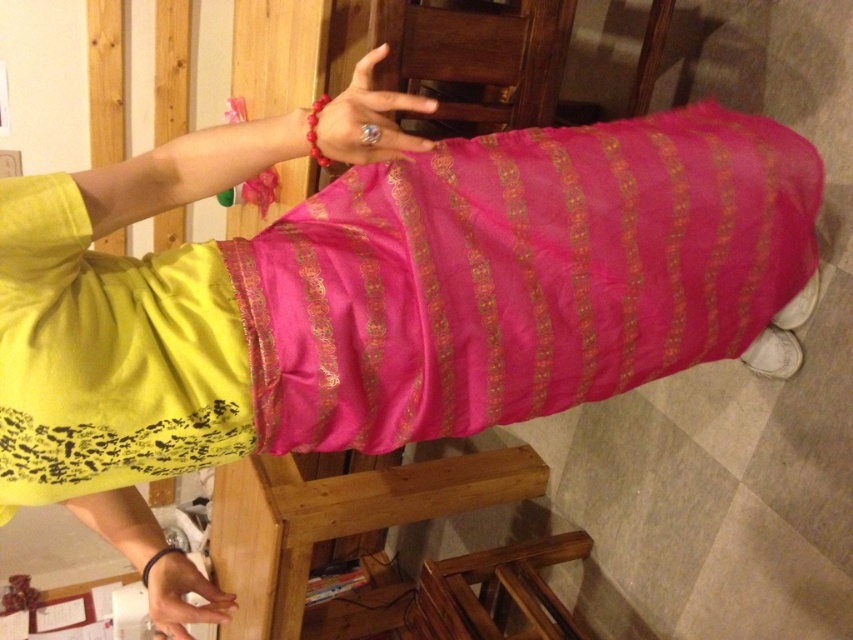
You are a photographer setting up a shoot in this room. You want to ensure the matte gold ring at upper center is fully visible without being blocked by the shiny silk dress at center. What adjustment can you make to the setup?

Move the shiny silk dress at center slightly to the side so that the matte gold ring at upper center is no longer blocked by it.

You are a fashion designer observing the image. You need to determine which fabric is closer to the camera between the shiny silk dress at center and the matte pink fabric at lower center. Which one is closer?

The shiny silk dress at center is closer to the camera because it is in front of the matte pink fabric at lower center.

You are standing in the room and want to pick up an item from the table. The item is located at one of the two points mentioned. Which point is closer to you, point (683,115) or point (158,604)?

Point (158,604) is closer to you because it is less further to the viewer than point (683,115).